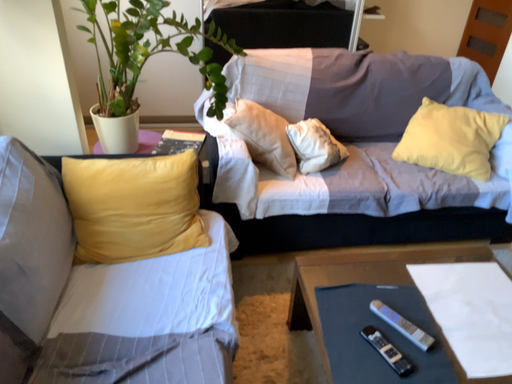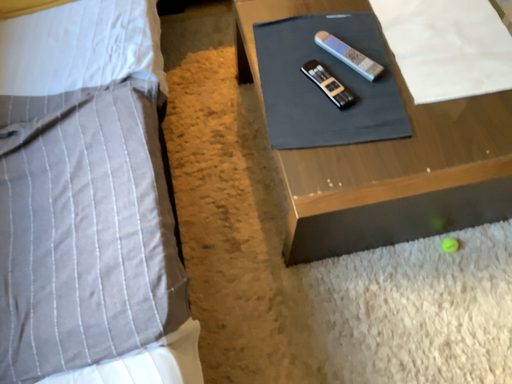
Question: Which way did the camera rotate in the video?

Choices:
 (A) rotated downward
 (B) rotated upward

Answer: (A)